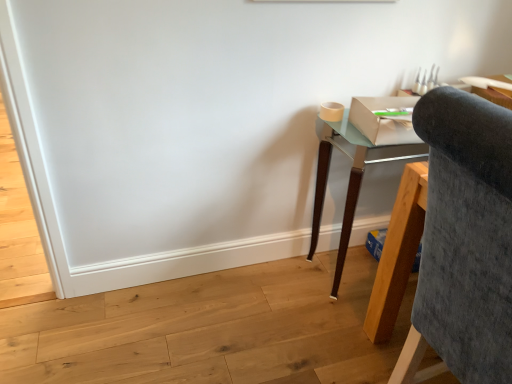
At what (x,y) coordinates should I click in order to perform the action: click on free space to the left of teal glass desk at right. Please return your answer as a coordinate pair (x, y). The width and height of the screenshot is (512, 384). Looking at the image, I should click on (280, 292).